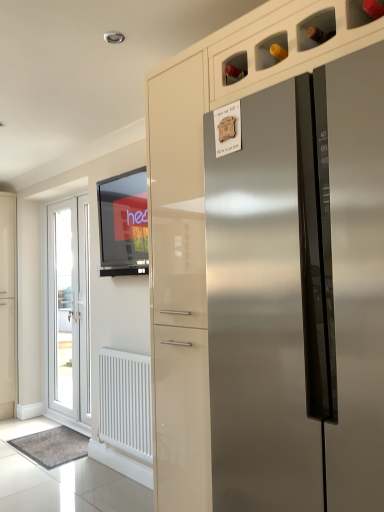
Question: Does stainless steel refrigerator at center have a smaller size compared to white glossy door at left?

Choices:
 (A) yes
 (B) no

Answer: (B)

Question: Does stainless steel refrigerator at center appear on the right side of white glossy door at left?

Choices:
 (A) yes
 (B) no

Answer: (A)

Question: Can you confirm if stainless steel refrigerator at center is taller than white glossy door at left?

Choices:
 (A) yes
 (B) no

Answer: (B)

Question: Considering the relative sizes of stainless steel refrigerator at center and white glossy door at left in the image provided, is stainless steel refrigerator at center bigger than white glossy door at left?

Choices:
 (A) no
 (B) yes

Answer: (B)

Question: Is stainless steel refrigerator at center looking in the opposite direction of white glossy door at left?

Choices:
 (A) no
 (B) yes

Answer: (A)

Question: Looking at their shapes, would you say stainless steel refrigerator at center is wider or thinner than white glossy door at left?

Choices:
 (A) wide
 (B) thin

Answer: (A)

Question: In the image, is stainless steel refrigerator at center on the left side or the right side of white glossy door at left?

Choices:
 (A) left
 (B) right

Answer: (B)

Question: Is point (256, 161) positioned closer to the camera than point (54, 345)?

Choices:
 (A) farther
 (B) closer

Answer: (B)

Question: In terms of height, does stainless steel refrigerator at center look taller or shorter compared to white glossy door at left?

Choices:
 (A) tall
 (B) short

Answer: (B)

Question: Relative to stainless steel refrigerator at center, is white matte radiator at lower left in front or behind?

Choices:
 (A) behind
 (B) front

Answer: (A)

Question: Choose the correct answer: Is white matte radiator at lower left inside stainless steel refrigerator at center or outside it?

Choices:
 (A) outside
 (B) inside

Answer: (A)

Question: Considering the positions of white matte radiator at lower left and stainless steel refrigerator at center in the image, is white matte radiator at lower left wider or thinner than stainless steel refrigerator at center?

Choices:
 (A) wide
 (B) thin

Answer: (B)

Question: From a real-world perspective, is white matte radiator at lower left positioned above or below stainless steel refrigerator at center?

Choices:
 (A) above
 (B) below

Answer: (B)

Question: In terms of width, does white matte radiator at lower left look wider or thinner when compared to matte black tv at upper left?

Choices:
 (A) wide
 (B) thin

Answer: (A)

Question: From a real-world perspective, is white matte radiator at lower left positioned above or below matte black tv at upper left?

Choices:
 (A) below
 (B) above

Answer: (A)